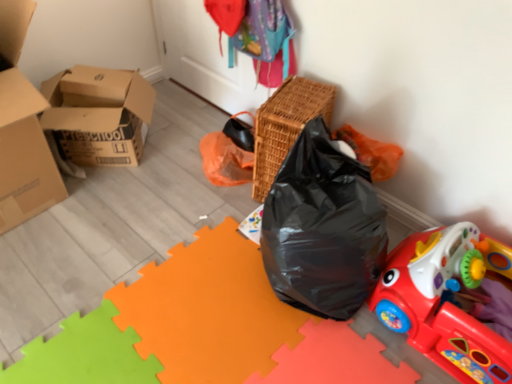
Question: Is woven brown basket at upper center facing towards rubberized plastic toy car at lower right?

Choices:
 (A) yes
 (B) no

Answer: (B)

Question: Is woven brown basket at upper center positioned far away from rubberized plastic toy car at lower right?

Choices:
 (A) yes
 (B) no

Answer: (B)

Question: Is rubberized plastic toy car at lower right surrounded by woven brown basket at upper center?

Choices:
 (A) yes
 (B) no

Answer: (B)

Question: From the image's perspective, is woven brown basket at upper center under rubberized plastic toy car at lower right?

Choices:
 (A) yes
 (B) no

Answer: (B)

Question: Is the position of woven brown basket at upper center more distant than that of rubberized plastic toy car at lower right?

Choices:
 (A) no
 (B) yes

Answer: (B)

Question: Considering the positions of rubberized plastic toy car at lower right and cardboard boxes at left in the image, is rubberized plastic toy car at lower right wider or thinner than cardboard boxes at left?

Choices:
 (A) wide
 (B) thin

Answer: (A)

Question: Is point (433, 266) positioned closer to the camera than point (67, 71)?

Choices:
 (A) farther
 (B) closer

Answer: (B)

Question: Is rubberized plastic toy car at lower right spatially inside cardboard boxes at left, or outside of it?

Choices:
 (A) outside
 (B) inside

Answer: (A)

Question: From their relative heights in the image, would you say rubberized plastic toy car at lower right is taller or shorter than cardboard boxes at left?

Choices:
 (A) short
 (B) tall

Answer: (A)

Question: Do you think woven brown basket at upper center is within rubberized plastic toy car at lower right, or outside of it?

Choices:
 (A) inside
 (B) outside

Answer: (B)

Question: Considering their positions, is woven brown basket at upper center located in front of or behind rubberized plastic toy car at lower right?

Choices:
 (A) behind
 (B) front

Answer: (A)

Question: Considering the positions of point (289, 134) and point (401, 311), is point (289, 134) closer or farther from the camera than point (401, 311)?

Choices:
 (A) closer
 (B) farther

Answer: (B)

Question: In terms of size, does woven brown basket at upper center appear bigger or smaller than rubberized plastic toy car at lower right?

Choices:
 (A) small
 (B) big

Answer: (A)

Question: From the image's perspective, is rubberized plastic toy car at lower right positioned above or below woven brown basket at upper center?

Choices:
 (A) below
 (B) above

Answer: (A)

Question: In terms of width, does rubberized plastic toy car at lower right look wider or thinner when compared to woven brown basket at upper center?

Choices:
 (A) thin
 (B) wide

Answer: (B)